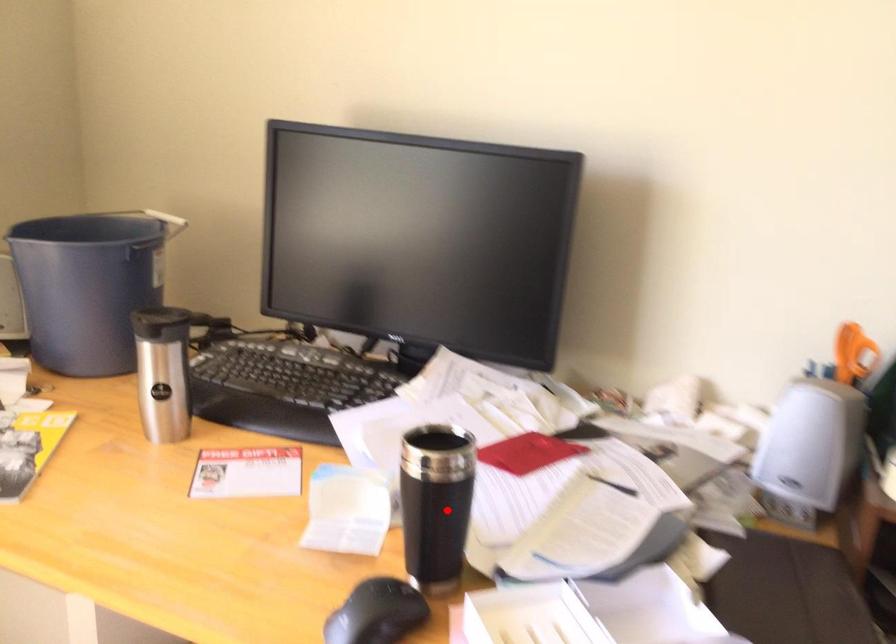
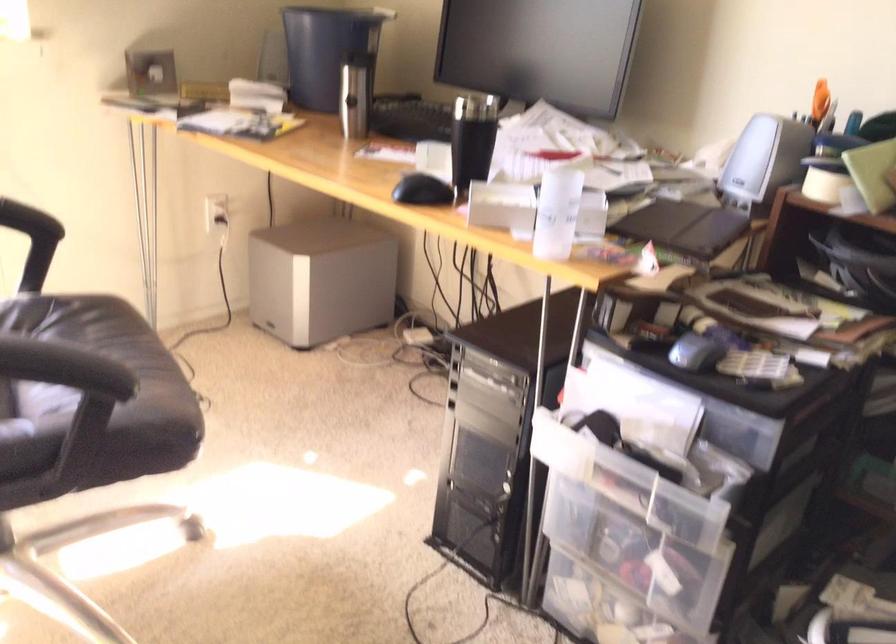
Locate, in the second image, the point that corresponds to the highlighted location in the first image.

(471, 140)